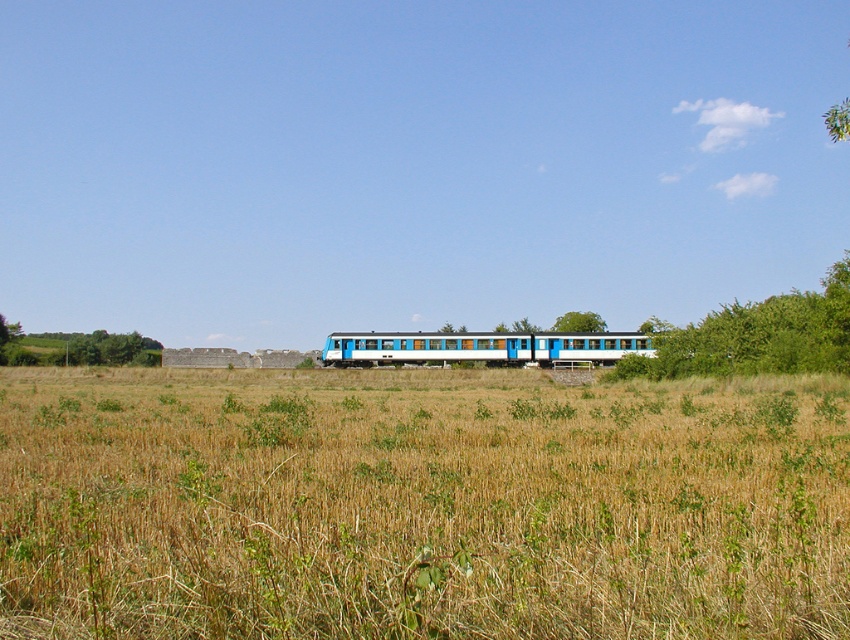
You are a bird looking for a nesting spot. You see two trees in the image, the green leafy tree at left and the green leafy tree at center. Which tree would be a better choice for nesting based on their sizes?

The green leafy tree at left is bigger than the green leafy tree at center, so it would be a better choice for nesting because larger trees typically provide more branches and foliage for a secure nest.

You are standing in the field of dry grass and want to use the green leafy tree at right and the green leafy tree at center to determine which one is taller. Based on the scene, which tree should you look up to more to see the top?

The green leafy tree at right is much taller than the green leafy tree at center, so you should look up more to see the top of the green leafy tree at right.

You are standing in the field of dry grass and see the green leafy tree at right and the green leafy tree at center. Which tree appears taller in the image?

The green leafy tree at right is taller than the green leafy tree at center according to the description.